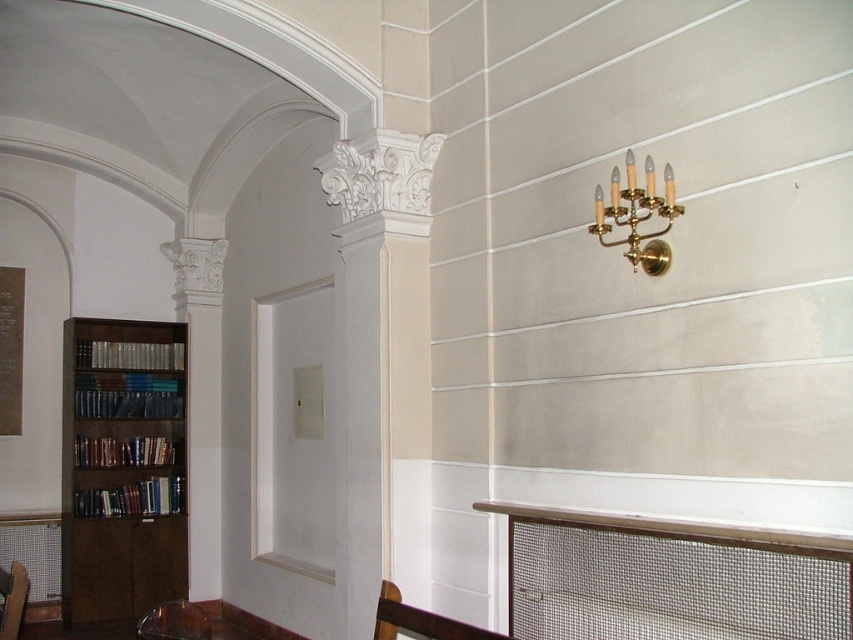
Which is in front, point (648, 252) or point (453, 621)?

Point (453, 621)

Between gold polished brass chandelier at upper right and brown wooden chair at lower center, which one is positioned lower?

brown wooden chair at lower center is lower down.

Does point (659, 205) come in front of point (398, 598)?

No.

Identify the location of gold polished brass chandelier at upper right. (637, 214).

Does brown wooden chair at lower center have a larger size compared to wooden chair at lower left?

Indeed, brown wooden chair at lower center has a larger size compared to wooden chair at lower left.

Is point (389, 627) positioned before point (7, 582)?

Yes.

This screenshot has width=853, height=640. Identify the location of brown wooden chair at lower center. pos(421,620).

Between dark brown wood bookcase at left and wooden chair at lower left, which one has more height?

Standing taller between the two is dark brown wood bookcase at left.

Who is positioned more to the right, dark brown wood bookcase at left or wooden chair at lower left?

wooden chair at lower left

Who is more distant from viewer, (137, 401) or (12, 589)?

Positioned behind is point (137, 401).

Image resolution: width=853 pixels, height=640 pixels. Identify the location of dark brown wood bookcase at left. (122, 468).